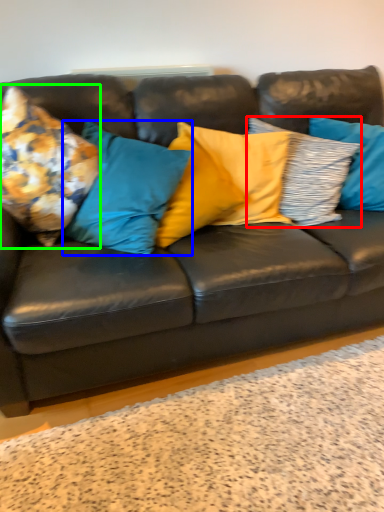
Question: Estimate the real-world distances between objects in this image. Which object is farther from pillow (highlighted by a red box), pillow (highlighted by a blue box) or pillow (highlighted by a green box)?

Choices:
 (A) pillow
 (B) pillow

Answer: (B)